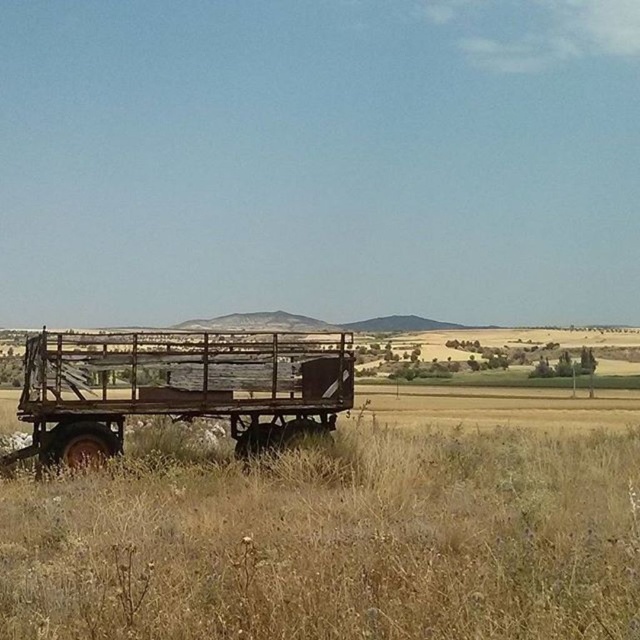
Does point (556, 461) come in front of point (248, 396)?

No, (556, 461) is further to viewer.

Locate an element on the screen. Image resolution: width=640 pixels, height=640 pixels. dry grass at lower center is located at coordinates (333, 541).